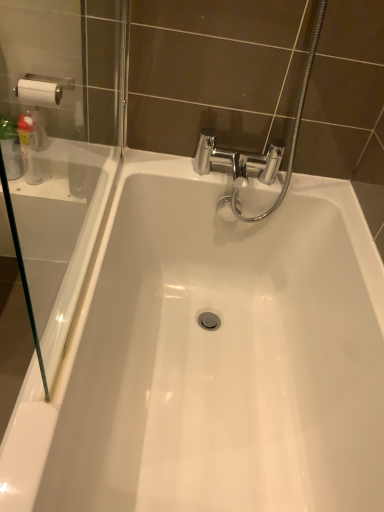
Question: Should I look upward or downward to see translucent plastic bottle at left?

Choices:
 (A) up
 (B) down

Answer: (A)

Question: Is translucent plastic bottle at left oriented towards white glossy bathtub at center?

Choices:
 (A) yes
 (B) no

Answer: (B)

Question: Can you confirm if translucent plastic bottle at left is smaller than white glossy bathtub at center?

Choices:
 (A) yes
 (B) no

Answer: (A)

Question: Considering the relative positions of translucent plastic bottle at left and white glossy bathtub at center in the image provided, is translucent plastic bottle at left to the left of white glossy bathtub at center from the viewer's perspective?

Choices:
 (A) yes
 (B) no

Answer: (A)

Question: Can white glossy bathtub at center be found inside translucent plastic bottle at left?

Choices:
 (A) no
 (B) yes

Answer: (A)

Question: Is translucent plastic bottle at left oriented away from white glossy bathtub at center?

Choices:
 (A) yes
 (B) no

Answer: (B)

Question: Is translucent plastic bottle at left positioned in front of white glossy bathtub at center?

Choices:
 (A) yes
 (B) no

Answer: (B)

Question: Would you say white glossy bathtub at center contains transparent glass screen door at left?

Choices:
 (A) no
 (B) yes

Answer: (A)

Question: Would you say white glossy bathtub at center is outside transparent glass screen door at left?

Choices:
 (A) yes
 (B) no

Answer: (A)

Question: Is white glossy bathtub at center behind transparent glass screen door at left?

Choices:
 (A) yes
 (B) no

Answer: (A)

Question: Considering the relative positions of white glossy bathtub at center and transparent glass screen door at left in the image provided, is white glossy bathtub at center in front of transparent glass screen door at left?

Choices:
 (A) yes
 (B) no

Answer: (B)

Question: Does white glossy bathtub at center appear on the left side of transparent glass screen door at left?

Choices:
 (A) yes
 (B) no

Answer: (B)

Question: From the image's perspective, would you say white glossy bathtub at center is positioned over transparent glass screen door at left?

Choices:
 (A) no
 (B) yes

Answer: (A)

Question: Can you confirm if transparent glass screen door at left is positioned to the right of translucent plastic bottle at left?

Choices:
 (A) yes
 (B) no

Answer: (A)